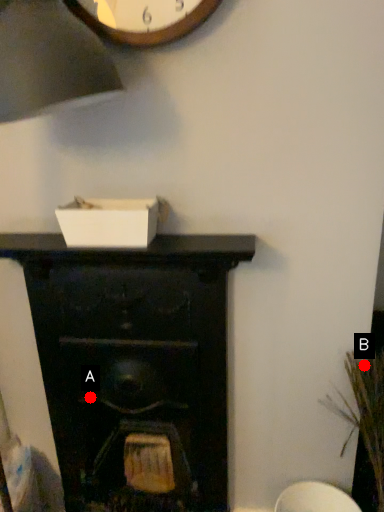
Question: Two points are circled on the image, labeled by A and B beside each circle. Which point is closer to the camera?

Choices:
 (A) A is closer
 (B) B is closer

Answer: (B)